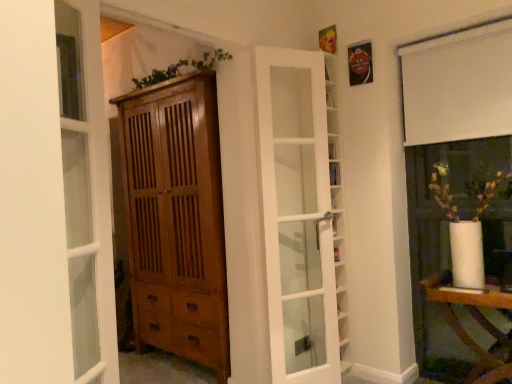
Locate an element on the screen. white matte curtain at upper right is located at coordinates (458, 85).

Where is `wooden cabinet at center`? The image size is (512, 384). wooden cabinet at center is located at coordinates (176, 219).

From a real-world perspective, is white matte curtain at upper right physically located above or below wooden cabinet at center?

Clearly, from a real-world perspective, white matte curtain at upper right is above wooden cabinet at center.

Looking at the image, does white matte curtain at upper right seem bigger or smaller compared to wooden cabinet at center?

white matte curtain at upper right is smaller than wooden cabinet at center.

Can you tell me how much white matte curtain at upper right and wooden cabinet at center differ in facing direction?

They differ by 0.667 degrees in their facing directions.

Looking at this image, between white matte curtain at upper right and wooden cabinet at center, which one has more height?

Standing taller between the two is wooden cabinet at center.

Is clear glass door at left turned away from white glossy table at lower right?

No, white glossy table at lower right is not at the back of clear glass door at left.

What's the angular difference between clear glass door at left and white glossy table at lower right's facing directions?

116 degrees.

Considering the relative positions of clear glass door at left and white glossy table at lower right in the image provided, is clear glass door at left behind white glossy table at lower right?

That is False.

Considering the relative positions of wooden cabinet at center and white glossy table at lower right in the image provided, is wooden cabinet at center to the left or to the right of white glossy table at lower right?

Clearly, wooden cabinet at center is on the left of white glossy table at lower right in the image.

Consider the image. Is wooden cabinet at center not near white glossy table at lower right?

wooden cabinet at center is far away from white glossy table at lower right.

Is point (189, 326) positioned behind point (506, 300)?

Yes.

Is wooden cabinet at center in front of or behind white glossy table at lower right in the image?

Visually, wooden cabinet at center is located behind white glossy table at lower right.

Locate an element on the screen. This screenshot has width=512, height=384. door that is below the white matte curtain at upper right (from the image's perspective) is located at coordinates (298, 212).

Looking at this image, is the depth of white glass door at center greater than that of white matte curtain at upper right?

That is True.

Between white glass door at center and white matte curtain at upper right, which one appears on the left side from the viewer's perspective?

white glass door at center.

How far apart are white glass door at center and white matte curtain at upper right?

white glass door at center is 30.37 inches away from white matte curtain at upper right.

Which object is more forward, wooden cabinet at center or white matte curtain at upper right?

white matte curtain at upper right is more forward.

From the picture: Would you say wooden cabinet at center is inside or outside white matte curtain at upper right?

wooden cabinet at center is spatially situated outside white matte curtain at upper right.

Which point is more distant from viewer, (131,287) or (436,88)?

The point (131,287) is more distant.

Is point (459, 294) positioned behind point (126, 161)?

No, (459, 294) is closer to viewer.

From a real-world perspective, is white glossy table at lower right positioned over wooden cabinet at center based on gravity?

No, from a real-world perspective, white glossy table at lower right is not on top of wooden cabinet at center.

Which is correct: white glossy table at lower right is inside wooden cabinet at center, or outside of it?

white glossy table at lower right exists outside the volume of wooden cabinet at center.

Image resolution: width=512 pixels, height=384 pixels. In the image, there is a white glass door at center. What are the coordinates of `cabinetry below it (from the image's perspective)` in the screenshot? It's located at (176, 219).

What's the angular difference between wooden cabinet at center and white glass door at center's facing directions?

The facing directions of wooden cabinet at center and white glass door at center are 68.2 degrees apart.

Is wooden cabinet at center in front of or behind white glass door at center in the image?

In the image, wooden cabinet at center appears behind white glass door at center.

Which object is positioned more to the right, wooden cabinet at center or white glass door at center?

Positioned to the right is white glass door at center.

This screenshot has height=384, width=512. In order to click on curtain lying in front of the wooden cabinet at center in this screenshot , I will do `click(458, 85)`.

Locate an element on the screen. The image size is (512, 384). window above the white glossy table at lower right (from a real-world perspective) is located at coordinates (86, 191).

From the image, which object appears to be farther from white glossy table at lower right, white glass door at center or white matte curtain at upper right?

white matte curtain at upper right.

Estimate the real-world distances between objects in this image. Which object is further from clear glass door at left, white glossy table at lower right or white matte curtain at upper right?

white matte curtain at upper right is further to clear glass door at left.

From the image, which object appears to be nearer to clear glass door at left, white matte curtain at upper right or wooden cabinet at center?

The object closer to clear glass door at left is wooden cabinet at center.

Considering their positions, is white glass door at center positioned further to wooden cabinet at center than clear glass door at left?

clear glass door at left is positioned further to the anchor wooden cabinet at center.

Looking at the image, which one is located further to clear glass door at left, wooden cabinet at center or white matte curtain at upper right?

white matte curtain at upper right is further to clear glass door at left.

Looking at this image, considering their positions, is white glass door at center positioned further to white matte curtain at upper right than white glossy table at lower right?

white glossy table at lower right.

From the image, which object appears to be farther from white matte curtain at upper right, white glossy table at lower right or white glass door at center?

white glossy table at lower right is positioned further to the anchor white matte curtain at upper right.

Considering their positions, is white glass door at center positioned further to white glossy table at lower right than clear glass door at left?

clear glass door at left is positioned further to the anchor white glossy table at lower right.

The image size is (512, 384). Identify the location of door between clear glass door at left and wooden cabinet at center in the front-back direction. (298, 212).

This screenshot has width=512, height=384. I want to click on door between clear glass door at left and white glossy table at lower right, so (298, 212).

This screenshot has height=384, width=512. Find the location of `cabinetry situated between clear glass door at left and white glossy table at lower right from left to right`. cabinetry situated between clear glass door at left and white glossy table at lower right from left to right is located at coordinates (176, 219).

The width and height of the screenshot is (512, 384). What are the coordinates of `door situated between wooden cabinet at center and white matte curtain at upper right from left to right` in the screenshot? It's located at (298, 212).